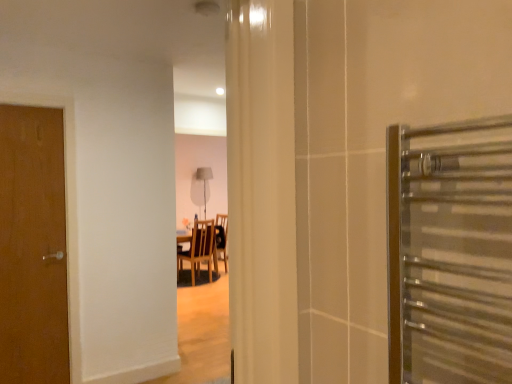
Question: Is wooden chair at center inside the boundaries of brown wood door at left, or outside?

Choices:
 (A) inside
 (B) outside

Answer: (B)

Question: In the image, is wooden chair at center on the left side or the right side of brown wood door at left?

Choices:
 (A) right
 (B) left

Answer: (A)

Question: Is point (208, 246) closer or farther from the camera than point (2, 200)?

Choices:
 (A) closer
 (B) farther

Answer: (B)

Question: In the image, is brown wood door at left on the left side or the right side of wooden chair at center?

Choices:
 (A) left
 (B) right

Answer: (A)

Question: Looking at their shapes, would you say brown wood door at left is wider or thinner than wooden chair at center?

Choices:
 (A) thin
 (B) wide

Answer: (A)

Question: From the image's perspective, relative to wooden chair at center, is brown wood door at left above or below?

Choices:
 (A) above
 (B) below

Answer: (A)

Question: In the image, is brown wood door at left positioned in front of or behind wooden chair at center?

Choices:
 (A) behind
 (B) front

Answer: (B)